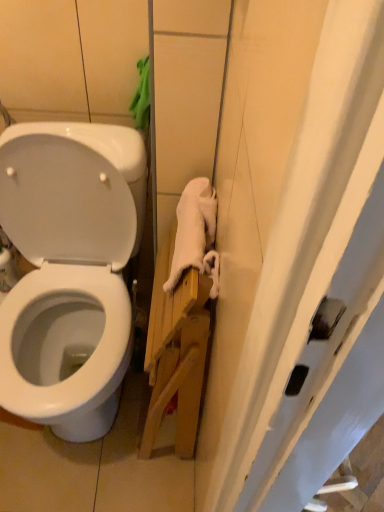
This screenshot has height=512, width=384. In order to click on white glossy toilet at upper left in this screenshot , I will do `click(67, 182)`.

Locate an element on the screen. Image resolution: width=384 pixels, height=512 pixels. white soft towel at right is located at coordinates (196, 234).

Which object is further away from the camera, white glossy toilet at upper left or white glossy toilet at left?

white glossy toilet at upper left.

Based on the photo, is white glossy toilet at left completely or partially inside white glossy toilet at upper left?

No.

Is white glossy toilet at upper left beside white glossy toilet at left?

Yes, white glossy toilet at upper left is with white glossy toilet at left.

Based on the photo, can you confirm if white glossy toilet at upper left is positioned to the left of white soft towel at right?

Indeed, white glossy toilet at upper left is positioned on the left side of white soft towel at right.

Does white glossy toilet at upper left touch white soft towel at right?

No, white glossy toilet at upper left is not next to white soft towel at right.

Is white glossy toilet at upper left oriented towards white soft towel at right?

Yes, white glossy toilet at upper left faces towards white soft towel at right.

Considering the relative sizes of white glossy toilet at upper left and white soft towel at right in the image provided, is white glossy toilet at upper left taller than white soft towel at right?

Yes, white glossy toilet at upper left is taller than white soft towel at right.

At what (x,y) coordinates should I click in order to perform the action: click on material above the white glossy toilet at left (from a real-world perspective). Please return your answer as a coordinate pair (x, y). This screenshot has width=384, height=512. Looking at the image, I should click on (196, 234).

From the image's perspective, which one is positioned lower, white soft towel at right or white glossy toilet at left?

white glossy toilet at left.

Is white soft towel at right in contact with white glossy toilet at left?

No, white soft towel at right is not making contact with white glossy toilet at left.

Is white soft towel at right inside or outside of white glossy toilet at left?

white soft towel at right is spatially situated outside white glossy toilet at left.

From the image's perspective, is white glossy toilet at left under white glossy toilet at upper left?

Indeed, from the image's perspective, white glossy toilet at left is shown beneath white glossy toilet at upper left.

Is the position of white glossy toilet at left less distant than that of white glossy toilet at upper left?

Yes.

Considering the relative sizes of white glossy toilet at left and white glossy toilet at upper left in the image provided, is white glossy toilet at left thinner than white glossy toilet at upper left?

Incorrect, the width of white glossy toilet at left is not less than that of white glossy toilet at upper left.

From the picture: Considering the relative positions of white glossy toilet at left and white glossy toilet at upper left in the image provided, is white glossy toilet at left to the left or to the right of white glossy toilet at upper left?

Based on their positions, white glossy toilet at left is located to the right of white glossy toilet at upper left.

Could you tell me if white glossy toilet at left is facing white soft towel at right?

No, white glossy toilet at left does not turn towards white soft towel at right.

Image resolution: width=384 pixels, height=512 pixels. Identify the location of toilet located on the left of white soft towel at right. (69, 271).

Based on the photo, how different are the orientations of white glossy toilet at left and white soft towel at right in degrees?

The facing directions of white glossy toilet at left and white soft towel at right are 0.000807 degrees apart.

Do you think white glossy toilet at left is within white soft towel at right, or outside of it?

The correct answer is: outside.

From a real-world perspective, is white soft towel at right positioned under white glossy toilet at upper left based on gravity?

Actually, white soft towel at right is physically above white glossy toilet at upper left in the real world.

Is white soft towel at right aimed at white glossy toilet at upper left?

No, white soft towel at right is not oriented towards white glossy toilet at upper left.

Considering their positions, is white soft towel at right located in front of or behind white glossy toilet at upper left?

white soft towel at right is in front of white glossy toilet at upper left.

Locate an element on the screen. back on the left side of white glossy toilet at left is located at coordinates (67, 182).

This screenshot has width=384, height=512. I want to click on the back behind the white soft towel at right, so click(x=67, y=182).

Looking at the image, which one is located closer to white soft towel at right, white glossy toilet at left or white glossy toilet at upper left?

white glossy toilet at upper left lies closer to white soft towel at right than the other object.

Considering their positions, is white soft towel at right positioned closer to white glossy toilet at left than white glossy toilet at upper left?

white glossy toilet at upper left is closer to white glossy toilet at left.

Estimate the real-world distances between objects in this image. Which object is further from white glossy toilet at left, white glossy toilet at upper left or white soft towel at right?

The object further to white glossy toilet at left is white soft towel at right.

Looking at the image, which one is located further to white glossy toilet at upper left, white soft towel at right or white glossy toilet at left?

Among the two, white soft towel at right is located further to white glossy toilet at upper left.

Estimate the real-world distances between objects in this image. Which object is closer to white soft towel at right, white glossy toilet at upper left or white glossy toilet at left?

white glossy toilet at upper left.

When comparing their distances from white glossy toilet at upper left, does white glossy toilet at left or white soft towel at right seem closer?

Among the two, white glossy toilet at left is located nearer to white glossy toilet at upper left.

Find the location of a particular element. The height and width of the screenshot is (512, 384). material located between white glossy toilet at left and white glossy toilet at upper left in the depth direction is located at coordinates (196, 234).